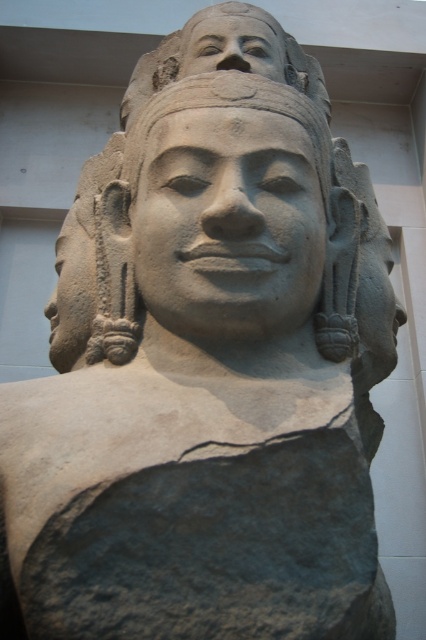
From the picture: Who is positioned more to the left, gray stone face at center or smooth stone face at upper center?

gray stone face at center

Between point (196, 116) and point (192, 68), which one is positioned behind?

The point (192, 68) is more distant.

Does point (201, 332) come farther from viewer compared to point (195, 72)?

No, (201, 332) is in front of (195, 72).

Identify the location of gray stone face at center. This screenshot has width=426, height=640. (229, 225).

In the scene shown: Does gray stone face at center have a lesser width compared to matte stone ear at left?

No.

Is point (282, 323) positioned after point (88, 248)?

That is False.

Identify the location of gray stone face at center. Image resolution: width=426 pixels, height=640 pixels. (229, 225).

The height and width of the screenshot is (640, 426). What are the coordinates of `gray stone face at center` in the screenshot? It's located at coord(229,225).

Is point (97, 320) positioned before point (190, 44)?

Yes.

Does matte stone ear at left come behind smooth stone face at upper center?

No, it is in front of smooth stone face at upper center.

Measure the distance between matte stone ear at left and camera.

3.83 meters

Where is `matte stone ear at left`? Image resolution: width=426 pixels, height=640 pixels. matte stone ear at left is located at coordinates (94, 269).